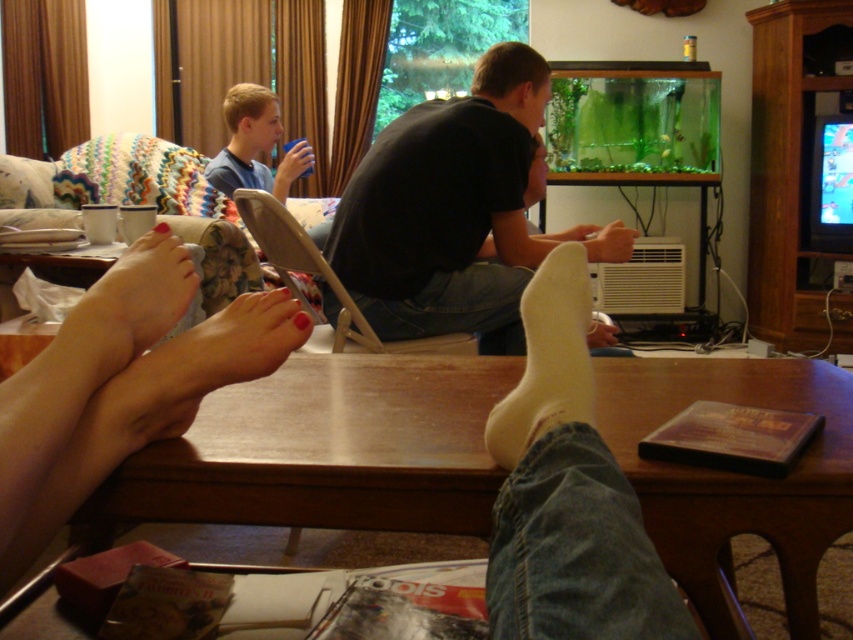
You are a delivery robot with a width of 1 meter. You need to move from the entrance to the living room to the black matte shirt at center. There is a white sock at lower right in your path. Can you pass between them without moving either object?

The distance between the white sock at lower right and the black matte shirt at center is 1.29 meters, which is wider than your 1 meter width. Therefore, you can pass through the space between them without moving either object.

You are a photographer standing in the living room and want to take a photo of the white sock at lower right and the black matte shirt at center. Which object will appear larger in the photo?

The white sock at lower right will appear larger in the photo because it is closer to the viewer than the black matte shirt at center.